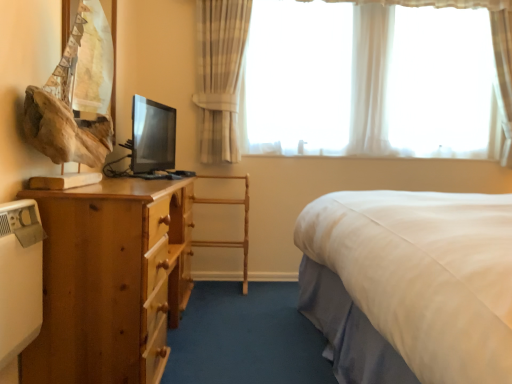
Locate an element on the screen. Image resolution: width=512 pixels, height=384 pixels. vacant area located to the right-hand side of wooden drawer at lower left is located at coordinates (221, 339).